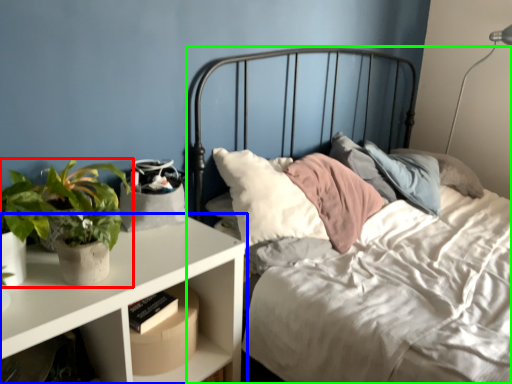
Question: Considering the real-world distances, which object is closest to houseplant (highlighted by a red box)? nightstand (highlighted by a blue box) or bed (highlighted by a green box).

Choices:
 (A) nightstand
 (B) bed

Answer: (A)